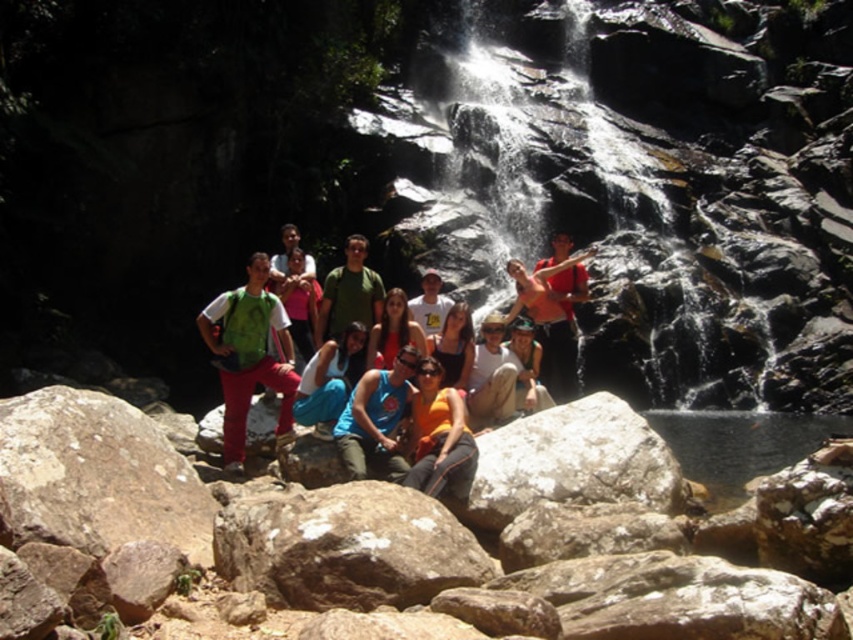
Question: Which object is farther from the camera taking this photo?

Choices:
 (A) gray rough rock at lower left
 (B) green fabric backpack at center
 (C) blue fabric tank top at center
 (D) orange fabric at center

Answer: (B)

Question: From the image, what is the correct spatial relationship of rocky brown at center in relation to orange fabric at center?

Choices:
 (A) above
 (B) below

Answer: (B)

Question: Which object appears farthest from the camera in this image?

Choices:
 (A) rocky brown at center
 (B) orange fabric at center

Answer: (B)

Question: Which object is positioned closest to the matte green backpack at center?

Choices:
 (A) rocky brown at center
 (B) blue fabric tank top at center
 (C) gray rough rock at lower left

Answer: (B)

Question: Can you confirm if rocky brown at center is positioned to the left of white rough rock at center?

Choices:
 (A) no
 (B) yes

Answer: (B)

Question: Does rocky brown at center appear over orange fabric at center?

Choices:
 (A) yes
 (B) no

Answer: (B)